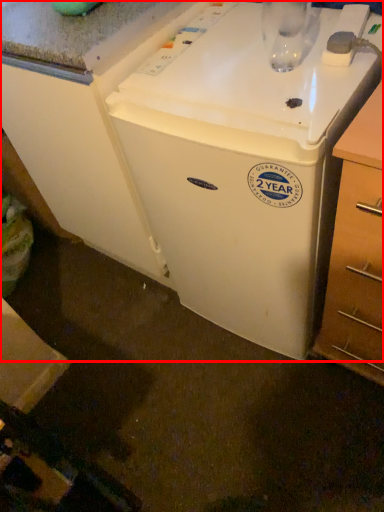
Question: From the image's perspective, where is home appliance (annotated by the red box) located relative to drawer?

Choices:
 (A) below
 (B) above

Answer: (B)